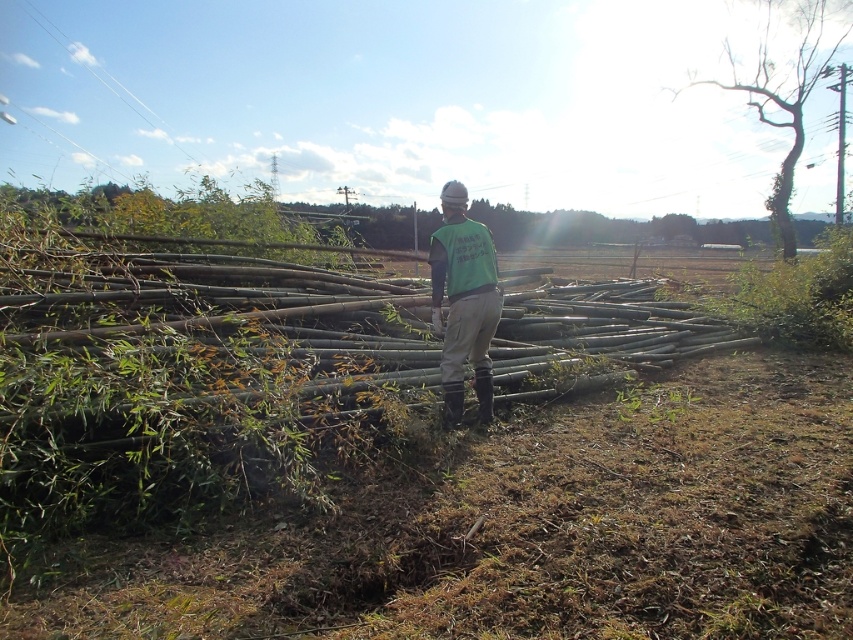
Which is more to the right, bare wood tree at upper right or green fabric vest at center?

bare wood tree at upper right is more to the right.

Is point (761, 1) closer to viewer compared to point (445, 186)?

That is False.

The image size is (853, 640). I want to click on bare wood tree at upper right, so click(x=785, y=83).